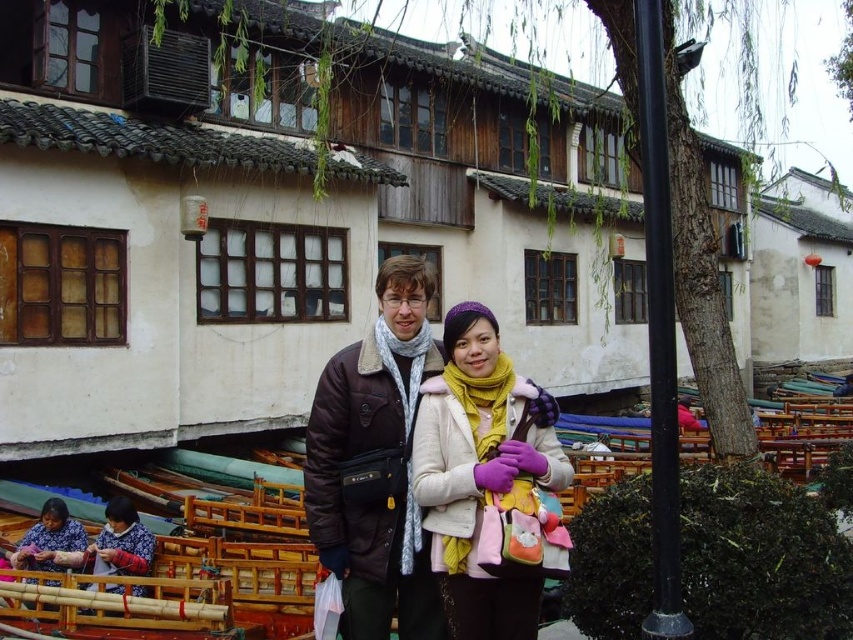
Is matte white coat at center to the left of brown fuzzy jacket at center from the viewer's perspective?

→ Incorrect, matte white coat at center is not on the left side of brown fuzzy jacket at center.

Can you confirm if matte white coat at center is positioned above brown fuzzy jacket at center?

Actually, matte white coat at center is below brown fuzzy jacket at center.

Find the location of `matte white coat at center`. matte white coat at center is located at coordinates (486, 483).

Between matte white coat at center and matte purple scarf at lower left, which one is positioned higher?

matte white coat at center

Which is behind, point (463, 531) or point (47, 500)?

The point (47, 500) is more distant.

Which is behind, point (547, 468) or point (48, 566)?

Point (48, 566)

Image resolution: width=853 pixels, height=640 pixels. In order to click on matte white coat at center in this screenshot , I will do `click(486, 483)`.

Can you confirm if matte white coat at center is positioned to the right of black metal pole at right?

No, matte white coat at center is not to the right of black metal pole at right.

Does matte white coat at center have a lesser height compared to black metal pole at right?

Yes, matte white coat at center is shorter than black metal pole at right.

What do you see at coordinates (486, 483) in the screenshot?
I see `matte white coat at center` at bounding box center [486, 483].

Find the location of a particular element. The height and width of the screenshot is (640, 853). matte white coat at center is located at coordinates (486, 483).